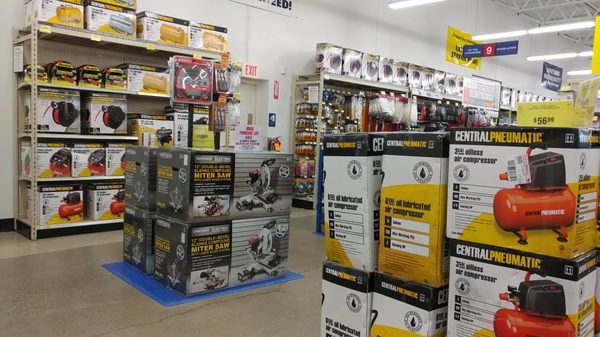
The image size is (600, 337). I want to click on blue poster sign, so click(x=551, y=82).